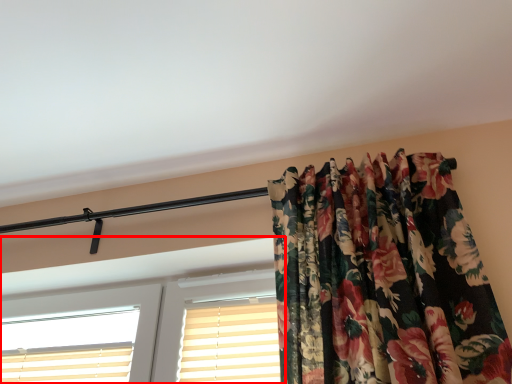
Question: From the image's perspective, where is window (annotated by the red box) located in relation to shutter in the image?

Choices:
 (A) below
 (B) above

Answer: (A)